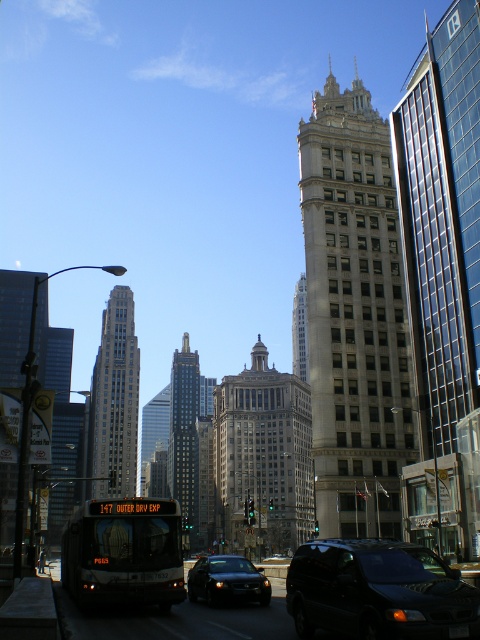
You are an architect analyzing the urban layout. Based on the scene, which of the two buildings, the light beige stone tower at center or the matte glass skyscraper at left, is situated higher in elevation relative to the other?

The light beige stone tower at center is positioned over the matte glass skyscraper at left, meaning it is higher in elevation.

You are standing on the sidewalk in this scene and want to take a photo of the light beige stone tower at center. The camera you have can focus on objects up to 70 meters away. Will the tower be in focus?

The light beige stone tower at center is 65.89 meters from viewer, which is within the camera focus range of 70 meters. Therefore, the tower will be in focus.

You are an architect analyzing the urban layout. Given that both the gray stone skyscraper at center and the dark gray glass skyscraper at center are visible in the cityscape, which one appears to take up more visual space in the image?

The dark gray glass skyscraper at center occupies more visual space than the gray stone skyscraper at center.